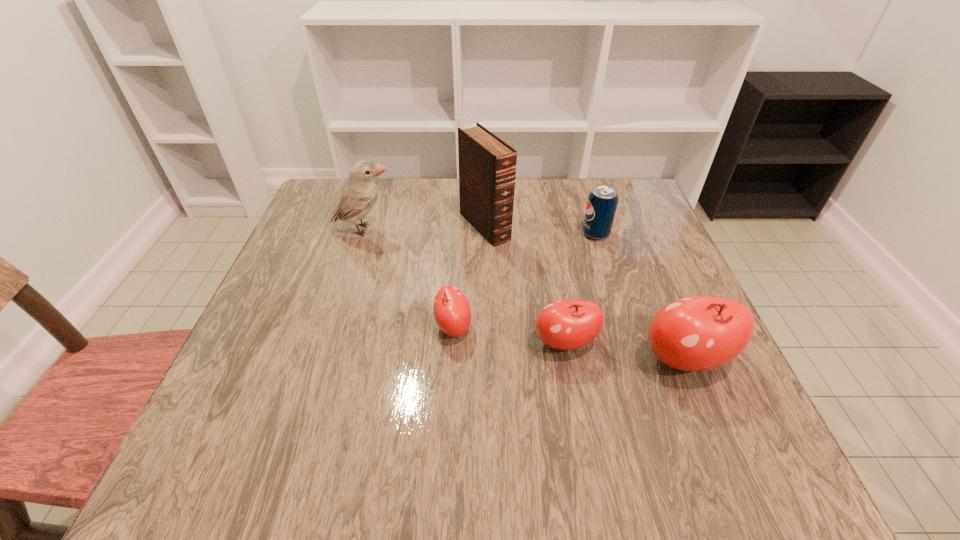
You are a GUI agent. You are given a task and a screenshot of the screen. Output one action in this format:
    pyautogui.click(x=<x>, y=<y>)
    Task: Click on the shortest object
    
    Given the screenshot: What is the action you would take?
    pyautogui.click(x=452, y=312)

Locate an element on the screen. the leftmost apple is located at coordinates (452, 312).

Locate an element on the screen. Image resolution: width=960 pixels, height=540 pixels. the second tallest apple is located at coordinates (567, 324).

Locate an element on the screen. The height and width of the screenshot is (540, 960). the second apple from right to left is located at coordinates (567, 324).

I want to click on the tallest apple, so click(x=696, y=333).

You are a GUI agent. You are given a task and a screenshot of the screen. Output one action in this format:
    pyautogui.click(x=<x>, y=<y>)
    Task: Click on the tallest object
    The image size is (960, 540).
    Given the screenshot: What is the action you would take?
    pyautogui.click(x=487, y=165)

Identify the location of the leftmost object. (359, 194).

Where is `soda can`? soda can is located at coordinates (602, 202).

The image size is (960, 540). In order to click on free space located on the front of the shortest object in this screenshot , I will do `click(449, 397)`.

I want to click on vacant space located on the back of the second shortest apple, so tap(549, 252).